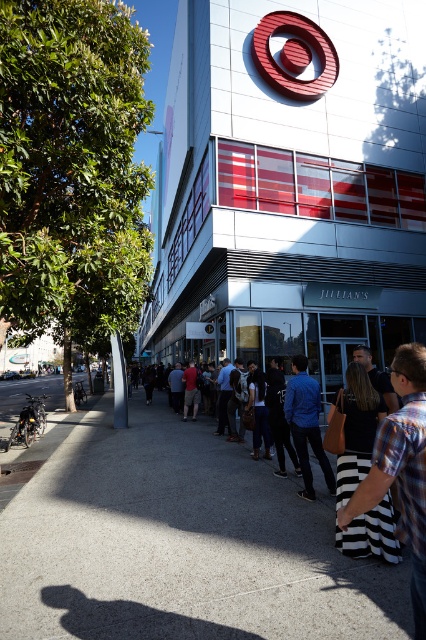
Question: Which point is farther to the camera?

Choices:
 (A) (192, 451)
 (B) (301, 397)

Answer: (A)

Question: Can you confirm if white glass building at center is smaller than denim jacket at center?

Choices:
 (A) no
 (B) yes

Answer: (A)

Question: Is gray concrete sidewalk at center closer to camera compared to denim jacket at center?

Choices:
 (A) yes
 (B) no

Answer: (A)

Question: Which is farther from the gray concrete sidewalk at center?

Choices:
 (A) denim jacket at center
 (B) white glass building at center
 (C) red shirt at center

Answer: (B)

Question: Does striped fabric skirt at lower right appear under red shirt at center?

Choices:
 (A) yes
 (B) no

Answer: (B)

Question: Which point is farther from the camera taking this photo?

Choices:
 (A) (195, 413)
 (B) (192, 1)
 (C) (399, 477)

Answer: (B)